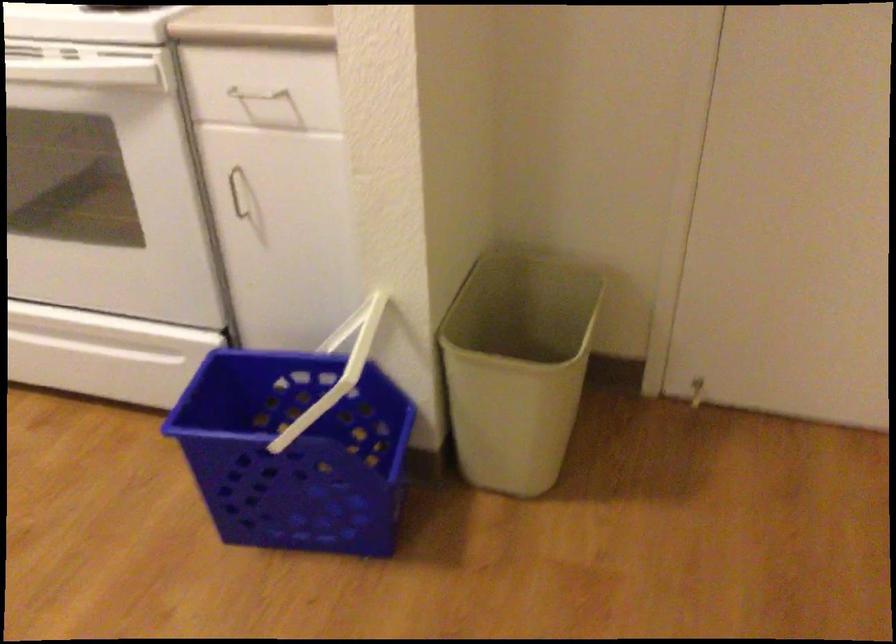
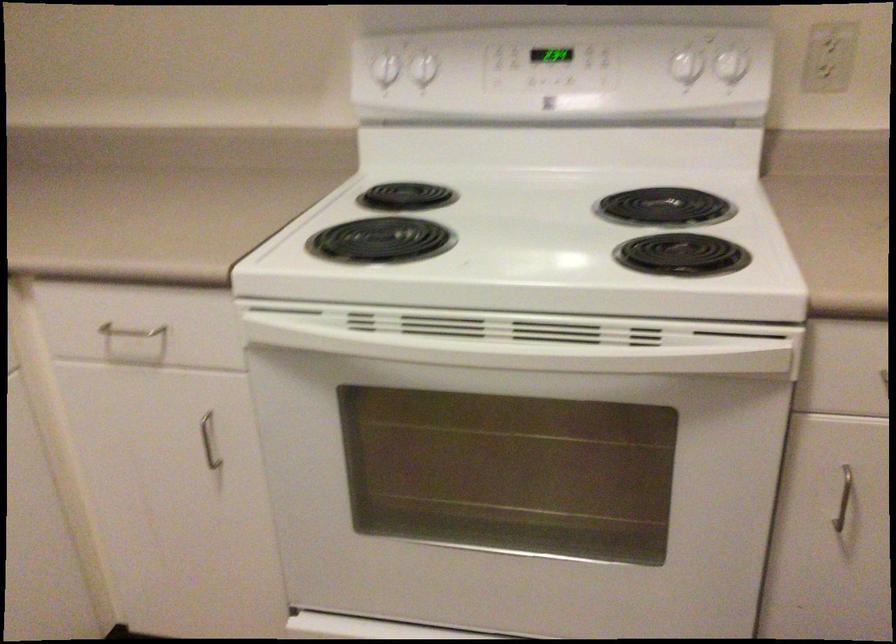
Find the pixel in the second image that matches [252,201] in the first image.

(842, 498)